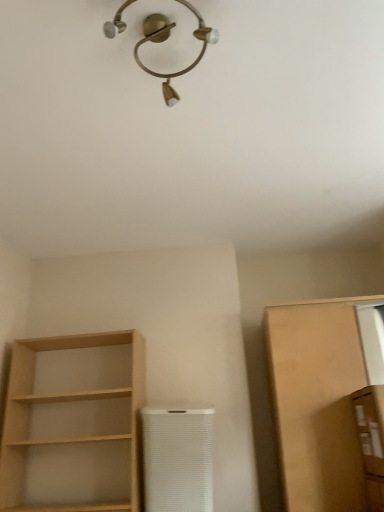
Question: Is point (203, 480) positioned closer to the camera than point (6, 397)?

Choices:
 (A) closer
 (B) farther

Answer: (A)

Question: From the image's perspective, is white textured air purifier at center above or below light wood shelf at left?

Choices:
 (A) below
 (B) above

Answer: (A)

Question: Based on their relative distances, which object is farther from the matte brown cabinet at right, the first cabinetry viewed from the back?

Choices:
 (A) brown cardboard box at right, the second cabinetry viewed from the back
 (B) white textured air purifier at center
 (C) light wood shelf at left
 (D) gold metallic light fixture at upper center

Answer: (D)

Question: Which object is the closest to the brown cardboard box at right, the second cabinetry viewed from the back?

Choices:
 (A) gold metallic light fixture at upper center
 (B) light wood shelf at left
 (C) matte brown cabinet at right, acting as the 2th cabinetry starting from the front
 (D) white textured air purifier at center

Answer: (C)